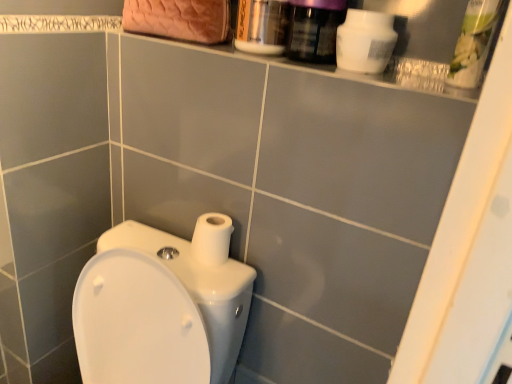
Question: From the image's perspective, is green plastic container at upper right, arranged as the 2th cleaning product when viewed from the left, beneath white glossy toilet at lower left?

Choices:
 (A) yes
 (B) no

Answer: (B)

Question: Is green plastic container at upper right, arranged as the 2th cleaning product when viewed from the left, far from white glossy toilet at lower left?

Choices:
 (A) no
 (B) yes

Answer: (A)

Question: Considering the relative positions of green plastic container at upper right, arranged as the 2th cleaning product when viewed from the left, and white glossy toilet at lower left in the image provided, is green plastic container at upper right, arranged as the 2th cleaning product when viewed from the left, to the left of white glossy toilet at lower left from the viewer's perspective?

Choices:
 (A) no
 (B) yes

Answer: (A)

Question: Is green plastic container at upper right, arranged as the 2th cleaning product when viewed from the left, positioned beyond the bounds of white glossy toilet at lower left?

Choices:
 (A) no
 (B) yes

Answer: (B)

Question: Is green plastic container at upper right, marked as the first cleaning product in a right-to-left arrangement, closer to the viewer compared to white glossy toilet at lower left?

Choices:
 (A) yes
 (B) no

Answer: (B)

Question: From a real-world perspective, does green plastic container at upper right, arranged as the 2th cleaning product when viewed from the left, stand above white glossy toilet at lower left?

Choices:
 (A) yes
 (B) no

Answer: (A)

Question: Considering the relative sizes of white matte bottle at upper right, which is the second cleaning product in right-to-left order, and metallic silver mouthwash at upper center, positioned as the first mouthwash in left-to-right order, in the image provided, is white matte bottle at upper right, which is the second cleaning product in right-to-left order, wider than metallic silver mouthwash at upper center, positioned as the first mouthwash in left-to-right order,?

Choices:
 (A) yes
 (B) no

Answer: (B)

Question: Can you confirm if white matte bottle at upper right, which is the second cleaning product in right-to-left order, is smaller than metallic silver mouthwash at upper center, marked as the 2th mouthwash in a right-to-left arrangement?

Choices:
 (A) no
 (B) yes

Answer: (B)

Question: Could you tell me if white matte bottle at upper right, marked as the 1th cleaning product in a left-to-right arrangement, is turned towards metallic silver mouthwash at upper center, positioned as the first mouthwash in left-to-right order?

Choices:
 (A) no
 (B) yes

Answer: (A)

Question: Considering the relative positions of white matte bottle at upper right, marked as the 1th cleaning product in a left-to-right arrangement, and metallic silver mouthwash at upper center, positioned as the first mouthwash in left-to-right order, in the image provided, is white matte bottle at upper right, marked as the 1th cleaning product in a left-to-right arrangement, to the right of metallic silver mouthwash at upper center, positioned as the first mouthwash in left-to-right order, from the viewer's perspective?

Choices:
 (A) no
 (B) yes

Answer: (B)

Question: From a real-world perspective, is white matte bottle at upper right, marked as the 1th cleaning product in a left-to-right arrangement, positioned under metallic silver mouthwash at upper center, positioned as the first mouthwash in left-to-right order, based on gravity?

Choices:
 (A) no
 (B) yes

Answer: (B)

Question: Can you confirm if white matte bottle at upper right, which is the second cleaning product in right-to-left order, is shorter than metallic silver mouthwash at upper center, marked as the 2th mouthwash in a right-to-left arrangement?

Choices:
 (A) no
 (B) yes

Answer: (B)

Question: Considering the relative sizes of white matte toilet paper at center and green plastic container at upper right, arranged as the 2th cleaning product when viewed from the left, in the image provided, is white matte toilet paper at center bigger than green plastic container at upper right, arranged as the 2th cleaning product when viewed from the left,?

Choices:
 (A) no
 (B) yes

Answer: (A)